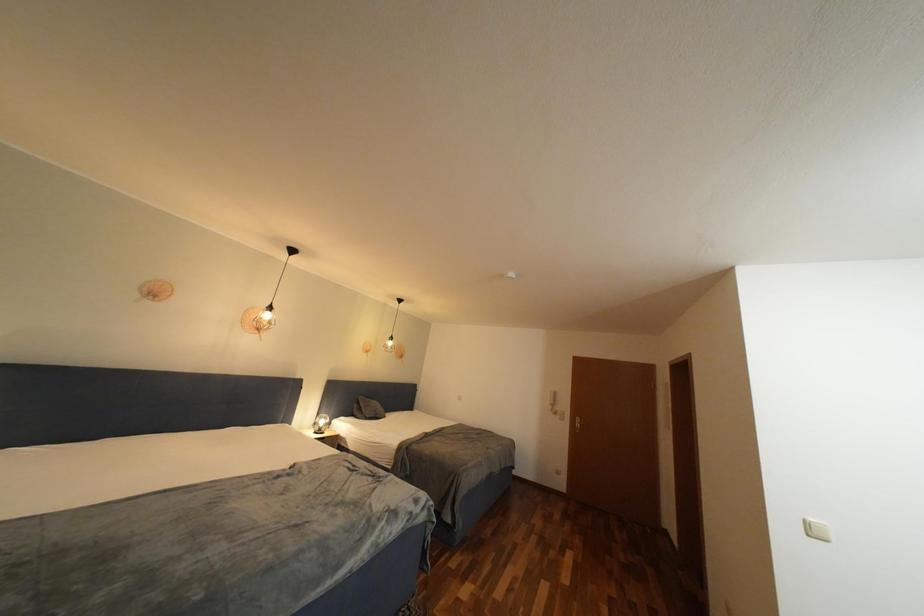
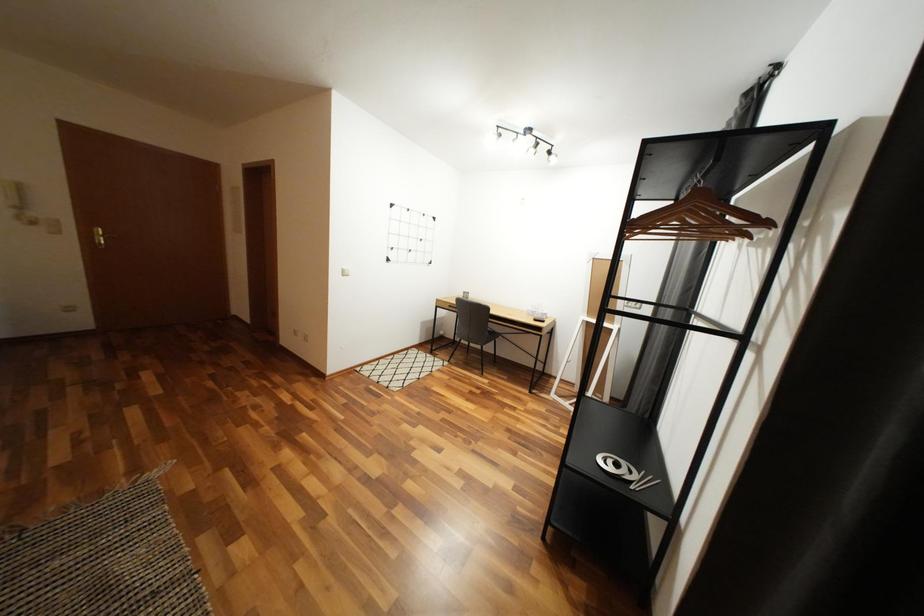
How did the camera likely rotate?

The camera's rotation is toward right-down.